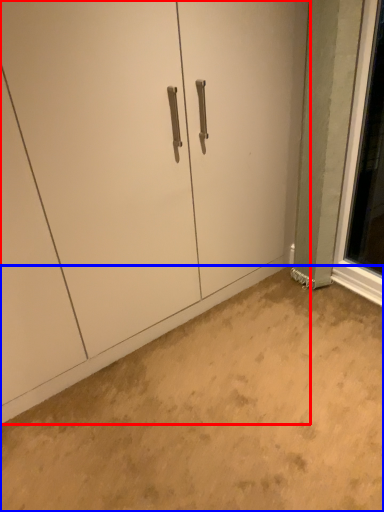
Question: Which object appears closest to the camera in this image, door (highlighted by a red box) or concrete (highlighted by a blue box)?

Choices:
 (A) door
 (B) concrete

Answer: (B)